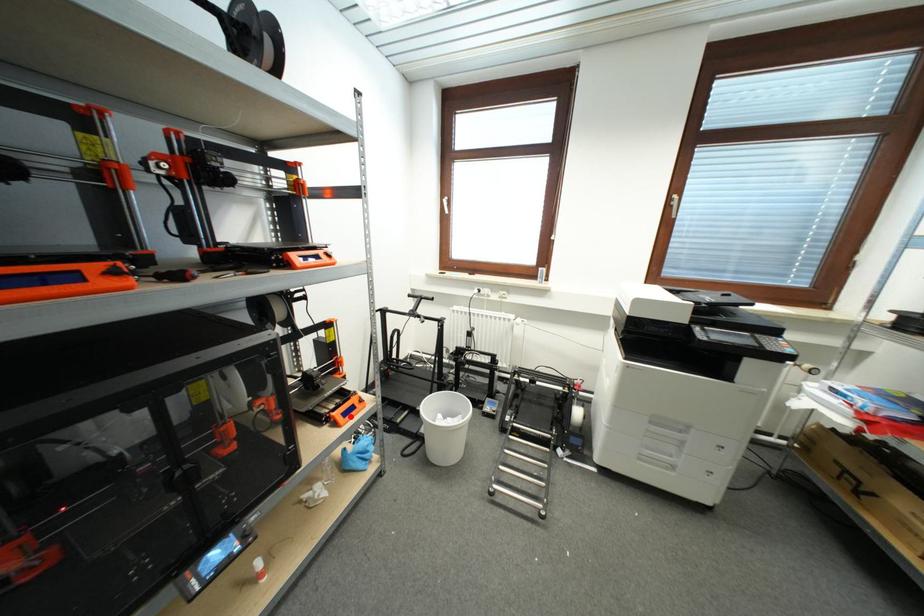
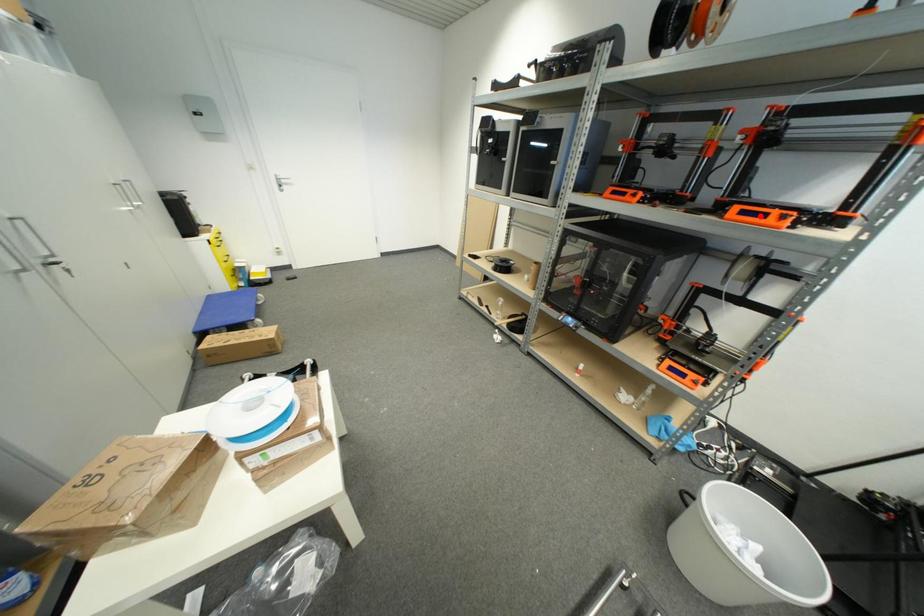
I am providing you with two images of the same scene from different viewpoints. A red point is marked on the first image and another point is marked on the second image. Does the point marked in image1 correspond to the same location as the one in image2?

No